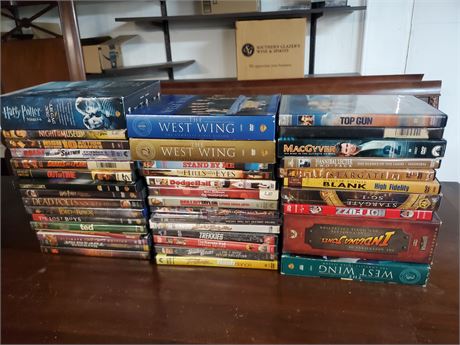
Locate an element on the screen. boxes is located at coordinates (246, 4), (262, 54), (98, 64), (53, 24).